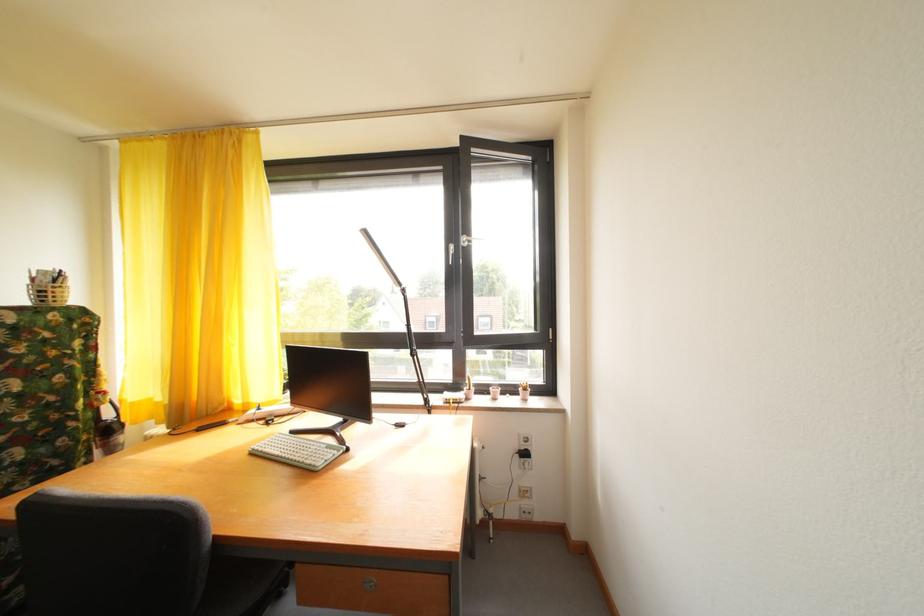
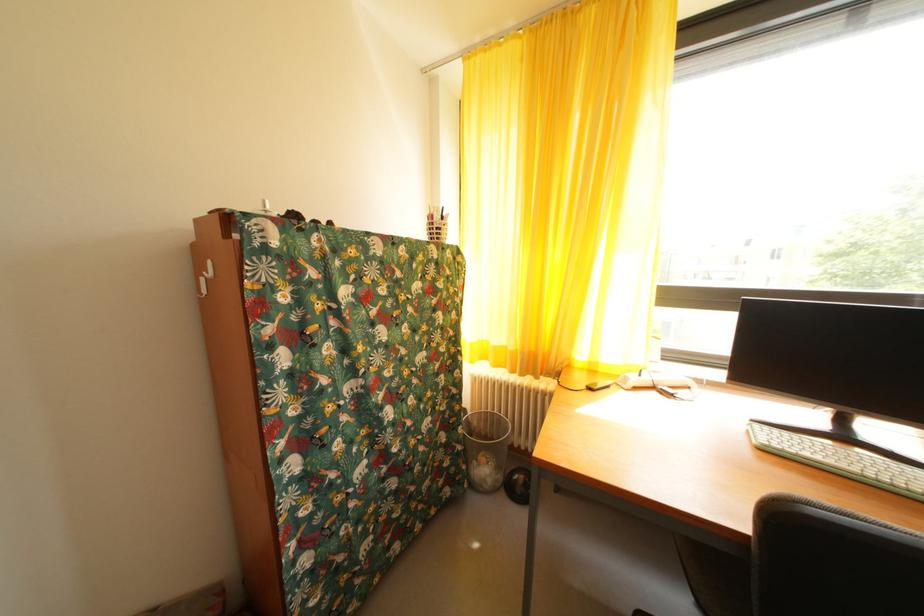
Question: In a continuous first-person perspective shot, in which direction is the camera moving?

Choices:
 (A) Left
 (B) Right
 (C) Forward
 (D) Backward

Answer: (A)